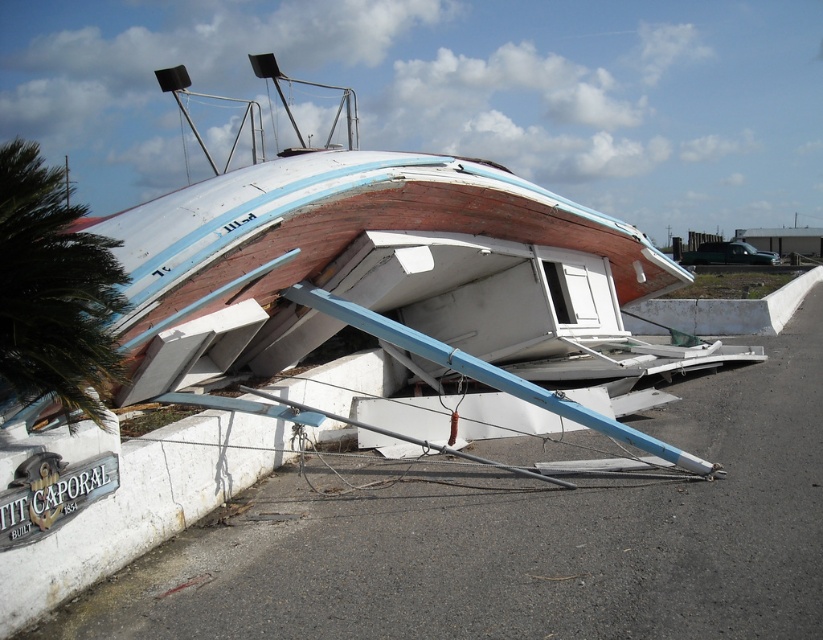
In the scene shown: You are a photographer standing at the edge of the shore. You want to capture a photo of the wooden boat at center and the green leafy palm tree at left in the same frame. Based on their positions, will the palm tree be visible behind the boat or in front of it?

The wooden boat at center is above green leafy palm tree at left, so the palm tree will be visible behind the boat in the photo.

You are standing on the shore and see the wooden boat at center and the green leafy palm tree at left. Which object is larger in size?

The wooden boat at center is bigger than the green leafy palm tree at left according to the description.